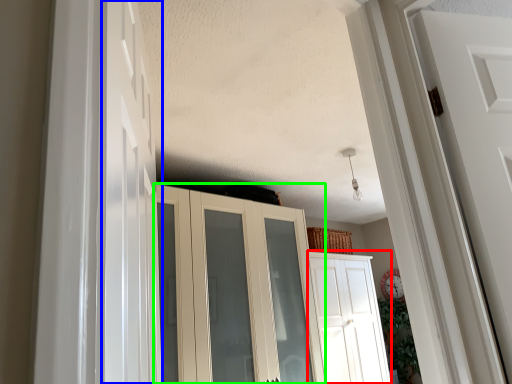
Question: Which is nearer to the door (highlighted by a red box)? door (highlighted by a blue box) or cupboard (highlighted by a green box).

Choices:
 (A) door
 (B) cupboard

Answer: (B)